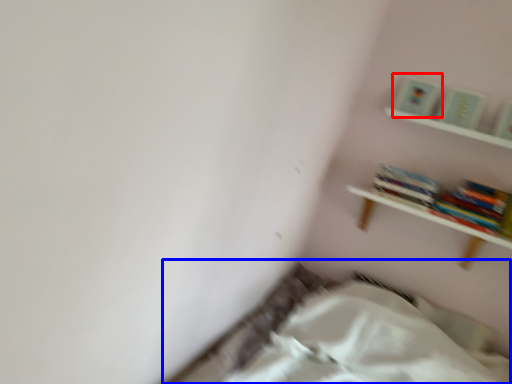
Question: Which object is further to the camera taking this photo, paperback book (highlighted by a red box) or bed (highlighted by a blue box)?

Choices:
 (A) paperback book
 (B) bed

Answer: (A)